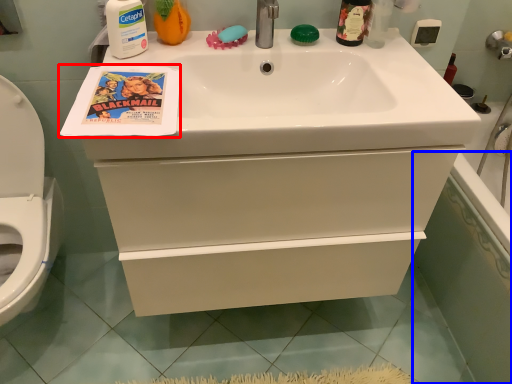
Question: Among these objects, which one is nearest to the camera, comic book (highlighted by a red box) or bath (highlighted by a blue box)?

Choices:
 (A) comic book
 (B) bath

Answer: (A)